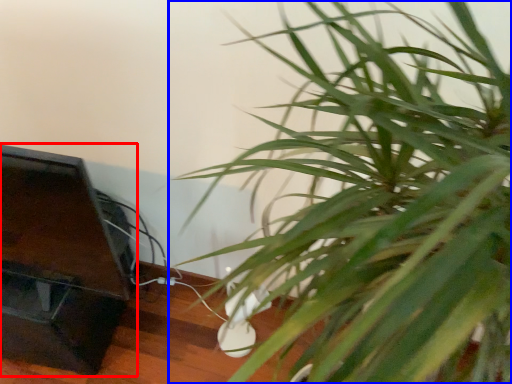
Question: Which object is further to the camera taking this photo, furniture (highlighted by a red box) or houseplant (highlighted by a blue box)?

Choices:
 (A) furniture
 (B) houseplant

Answer: (A)